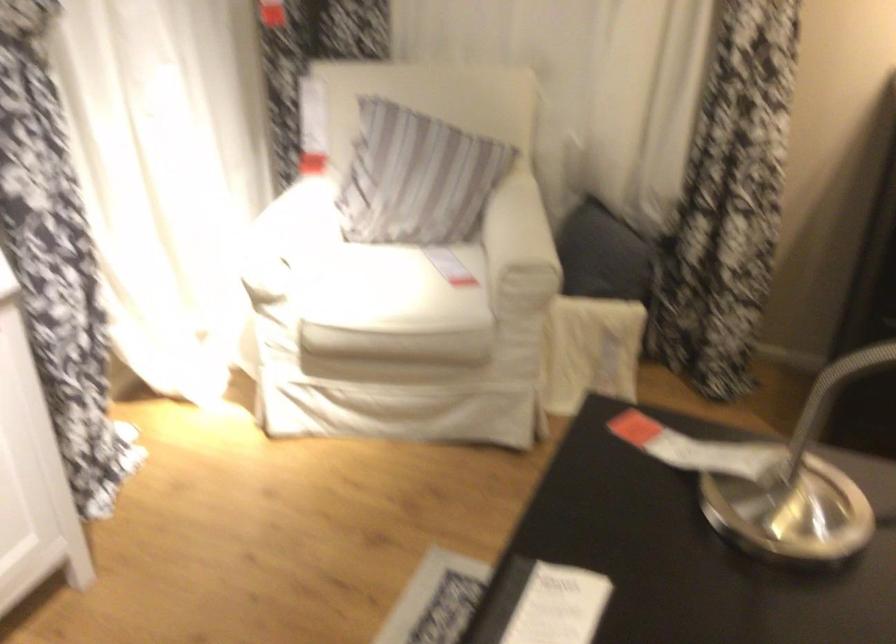
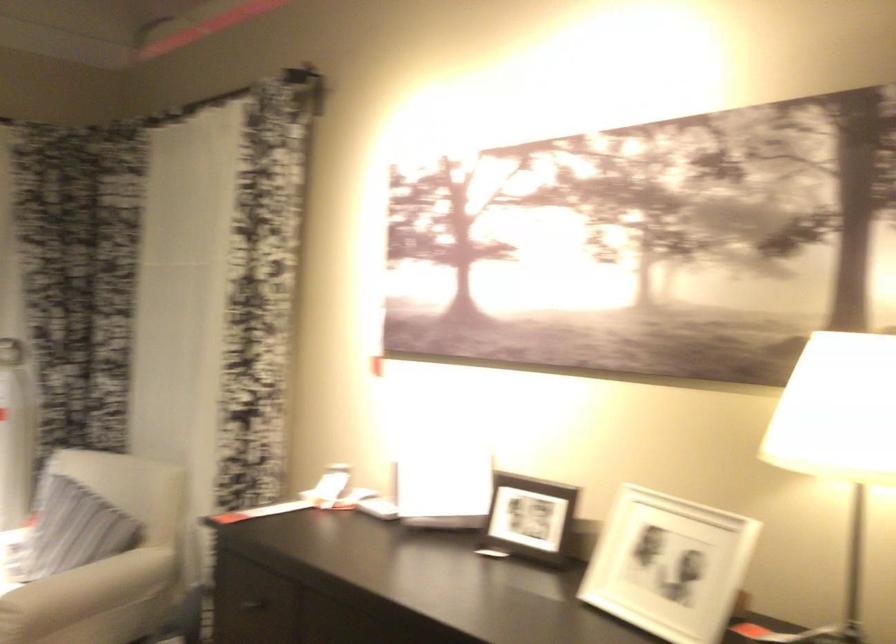
In the second image, find the point that corresponds to point 329,202 in the first image.

(15, 540)